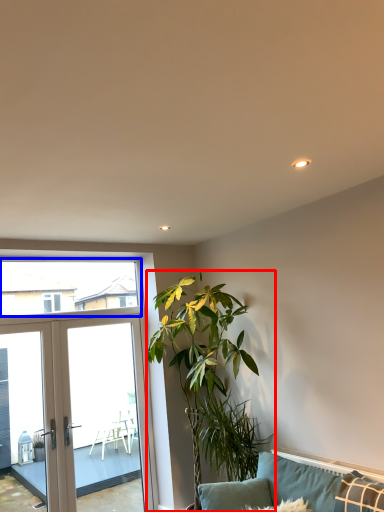
Question: Which point is further to the camera, houseplant (highlighted by a red box) or window screen (highlighted by a blue box)?

Choices:
 (A) houseplant
 (B) window screen

Answer: (B)